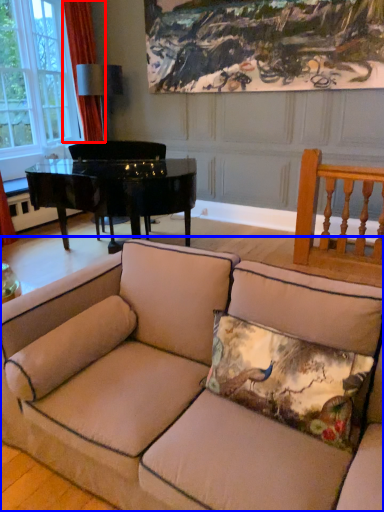
Question: Which point is further to the camera, curtain (highlighted by a red box) or studio couch (highlighted by a blue box)?

Choices:
 (A) curtain
 (B) studio couch

Answer: (A)